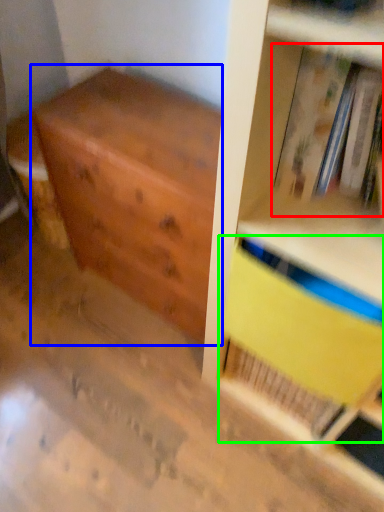
Question: Which is nearer to the book (highlighted by a red box)? chest of drawers (highlighted by a blue box) or paperback book (highlighted by a green box).

Choices:
 (A) chest of drawers
 (B) paperback book

Answer: (B)